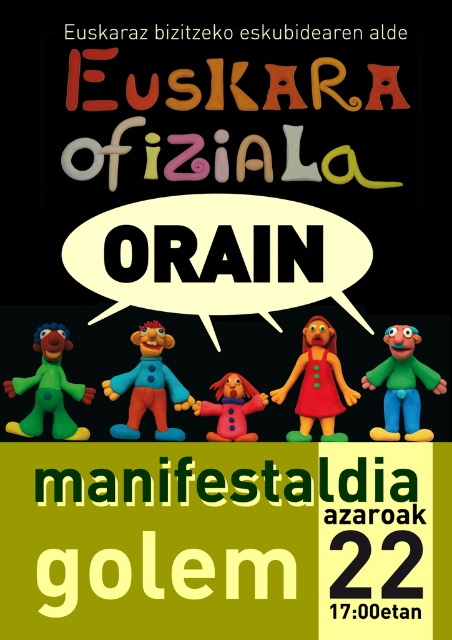
Question: Considering the real-world distances, which object is closest to the matte plastic clown at center?

Choices:
 (A) matte red plush dog at center
 (B) matte plastic doll at center
 (C) green clay figure at left
 (D) green matte clown at center

Answer: (C)

Question: Which is nearer to the green matte clown at center?

Choices:
 (A) matte plastic clown at center
 (B) matte red plush dog at center

Answer: (B)

Question: Is green matte clown at center to the right of matte red plush dog at center from the viewer's perspective?

Choices:
 (A) yes
 (B) no

Answer: (A)

Question: Does matte plastic clown at center appear under green matte clown at center?

Choices:
 (A) no
 (B) yes

Answer: (A)

Question: Does green matte clown at center appear on the right side of green clay figure at left?

Choices:
 (A) yes
 (B) no

Answer: (A)

Question: Which point is closer to the camera?

Choices:
 (A) matte plastic clown at center
 (B) green matte clown at center
 (C) matte red plush dog at center

Answer: (C)